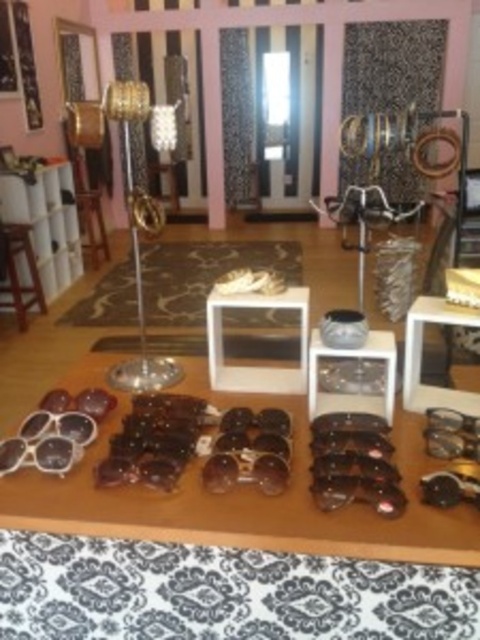
Is white plastic sunglasses at lower left thinner than sunglasses at lower left?

Indeed, white plastic sunglasses at lower left has a lesser width compared to sunglasses at lower left.

From the picture: Between white plastic sunglasses at lower left and sunglasses at lower left, which one is positioned higher?

sunglasses at lower left

Who is more distant from viewer, (31, 461) or (97, 401)?

Positioned behind is point (97, 401).

At what (x,y) coordinates should I click in order to perform the action: click on white plastic sunglasses at lower left. Please return your answer as a coordinate pair (x, y). The image size is (480, 640). Looking at the image, I should click on (39, 454).

Can you confirm if black plastic sunglasses at center is shorter than sunglasses at lower left?

Yes.

Between point (334, 442) and point (97, 408), which one is positioned in front?

Point (334, 442) is in front.

Locate an element on the screen. black plastic sunglasses at center is located at coordinates pyautogui.click(x=351, y=442).

The width and height of the screenshot is (480, 640). I want to click on black plastic sunglasses at center, so click(x=351, y=442).

Is point (330, 419) positioned in front of point (450, 419)?

No, (330, 419) is behind (450, 419).

Does matte brown sunglasses at center have a greater width compared to metallic silver goggles at lower right?

Correct, the width of matte brown sunglasses at center exceeds that of metallic silver goggles at lower right.

Find the location of `matte brown sunglasses at center`. matte brown sunglasses at center is located at coordinates (349, 422).

You are a GUI agent. You are given a task and a screenshot of the screen. Output one action in this format:
    pyautogui.click(x=<x>, y=<y>)
    Task: Click on the matte brown sunglasses at center
    The height and width of the screenshot is (640, 480).
    Given the screenshot: What is the action you would take?
    pyautogui.click(x=349, y=422)